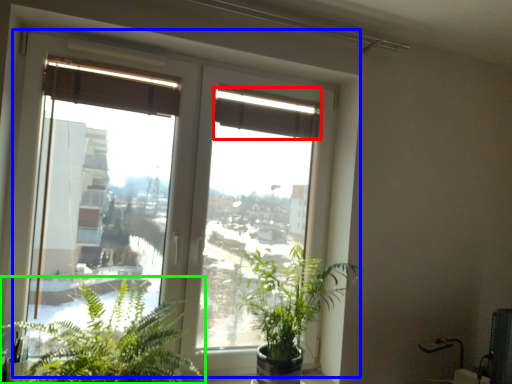
Question: Based on their relative distances, which object is farther from curtain (highlighted by a red box)? Choose from window (highlighted by a blue box) and houseplant (highlighted by a green box).

Choices:
 (A) window
 (B) houseplant

Answer: (B)